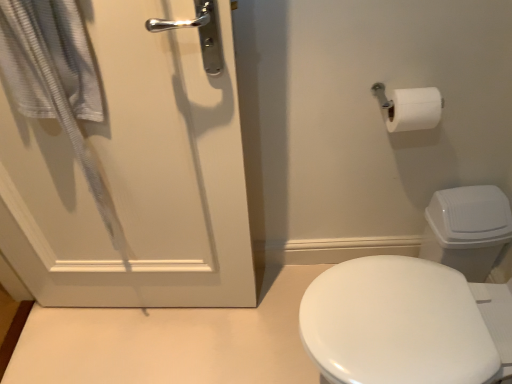
I want to click on white plastic toilet bowl at right, so click(467, 229).

Where is `white textured towel at left`? Image resolution: width=512 pixels, height=384 pixels. white textured towel at left is located at coordinates (57, 82).

This screenshot has width=512, height=384. What are the coordinates of `white matte door at left` in the screenshot? It's located at (135, 175).

Find the location of a particular element. white plastic toilet bowl at right is located at coordinates click(467, 229).

Can you confirm if white matte door at left is smaller than white textured towel at left?

No.

Is white matte door at left facing towards white textured towel at left?

Yes, white matte door at left is turned towards white textured towel at left.

Is point (156, 210) in front of point (81, 65)?

No, (156, 210) is further to viewer.

Which is in front, white matte door at left or white textured towel at left?

Positioned in front is white textured towel at left.

Is point (461, 196) positioned before point (51, 36)?

No, it is not.

Considering the sizes of white plastic toilet bowl at right and white textured towel at left in the image, is white plastic toilet bowl at right bigger or smaller than white textured towel at left?

Clearly, white plastic toilet bowl at right is smaller in size than white textured towel at left.

From the image's perspective, between white plastic toilet bowl at right and white textured towel at left, which one is located above?

white textured towel at left.

Could you tell me if white plastic toilet bowl at right is facing white textured towel at left?

No.

From a real-world perspective, which object stands above the other?

In real-world perspective, white textured towel at left is above.

From the image's perspective, between white textured towel at left and white plastic toilet bowl at right, who is located below?

white plastic toilet bowl at right is shown below in the image.

Considering the sizes of objects white textured towel at left and white plastic toilet bowl at right in the image provided, who is smaller, white textured towel at left or white plastic toilet bowl at right?

white plastic toilet bowl at right is smaller.

What's the angular difference between white textured towel at left and white plastic toilet bowl at right's facing directions?

0.7 degrees.

Which of these two, white textured towel at left or white matte door at left, is bigger?

Bigger between the two is white matte door at left.

Identify the location of bath towel on the left side of white matte door at left. This screenshot has width=512, height=384. (57, 82).

Considering the sizes of objects white textured towel at left and white matte door at left in the image provided, who is shorter, white textured towel at left or white matte door at left?

white textured towel at left.

Is point (38, 105) closer to camera compared to point (75, 172)?

Yes, point (38, 105) is closer to viewer.

Could you tell me if white matte door at left is turned towards white plastic toilet bowl at right?

No.

Is point (69, 178) positioned before point (464, 237)?

Yes, point (69, 178) is in front of point (464, 237).

Can you confirm if white matte door at left is wider than white plastic toilet bowl at right?

No, white matte door at left is not wider than white plastic toilet bowl at right.

Considering the relative sizes of white matte door at left and white plastic toilet bowl at right in the image provided, is white matte door at left shorter than white plastic toilet bowl at right?

In fact, white matte door at left may be taller than white plastic toilet bowl at right.

Locate an element on the screen. This screenshot has width=512, height=384. toilet bowl behind the white matte door at left is located at coordinates (467, 229).

Does white plastic toilet bowl at right appear on the left side of white matte door at left?

No.

From a real-world perspective, is white plastic toilet bowl at right above or below white matte door at left?

In terms of real-world spatial position, white plastic toilet bowl at right is below white matte door at left.

Looking at their sizes, would you say white plastic toilet bowl at right is wider or thinner than white matte door at left?

Clearly, white plastic toilet bowl at right has more width compared to white matte door at left.

In order to click on door behind the white textured towel at left in this screenshot , I will do `click(135, 175)`.

Find the location of a particular element. bath towel above the white plastic toilet bowl at right (from a real-world perspective) is located at coordinates (57, 82).

Looking at this image, considering their positions, is white plastic toilet bowl at right positioned further to white matte door at left than white textured towel at left?

Among the two, white plastic toilet bowl at right is located further to white matte door at left.

When comparing their distances from white plastic toilet bowl at right, does white matte door at left or white textured towel at left seem further?

white textured towel at left is further to white plastic toilet bowl at right.

Considering their positions, is white plastic toilet bowl at right positioned closer to white textured towel at left than white matte door at left?

white matte door at left.

Estimate the real-world distances between objects in this image. Which object is further from white textured towel at left, white matte door at left or white plastic toilet bowl at right?

Result: white plastic toilet bowl at right lies further to white textured towel at left than the other object.

Estimate the real-world distances between objects in this image. Which object is further from white matte door at left, white textured towel at left or white plastic toilet bowl at right?

A: Based on the image, white plastic toilet bowl at right appears to be further to white matte door at left.

Which object lies nearer to the anchor point white plastic toilet bowl at right, white textured towel at left or white matte door at left?

Among the two, white matte door at left is located nearer to white plastic toilet bowl at right.

You are a GUI agent. You are given a task and a screenshot of the screen. Output one action in this format:
    pyautogui.click(x=<x>, y=<y>)
    Task: Click on the door situated between white textured towel at left and white plastic toilet bowl at right from left to right
    
    Given the screenshot: What is the action you would take?
    (135, 175)